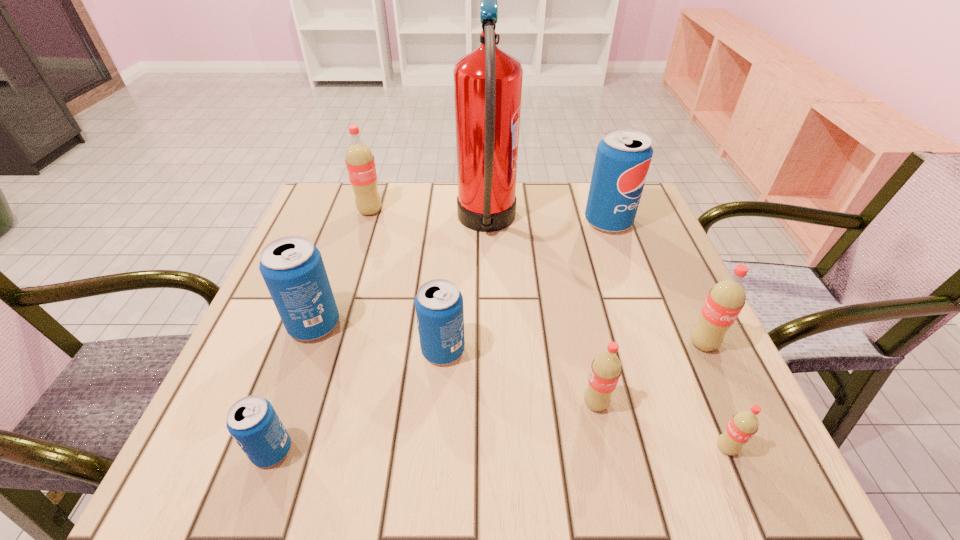
Identify the location of free space at the right edge of the desktop. (651, 294).

Locate an element on the screen. vacant space at the near right corner of the desktop is located at coordinates [x=780, y=478].

Where is `blank region between the fifth soda from right to left and the second smallest red soda`? Image resolution: width=960 pixels, height=540 pixels. blank region between the fifth soda from right to left and the second smallest red soda is located at coordinates (519, 376).

Where is `free space between the second biggest red soda and the third smallest blue soda can`? The width and height of the screenshot is (960, 540). free space between the second biggest red soda and the third smallest blue soda can is located at coordinates (509, 334).

Image resolution: width=960 pixels, height=540 pixels. I want to click on free point between the fourth soda from left to right and the nearest blue soda can, so click(358, 400).

The width and height of the screenshot is (960, 540). Identify the location of vacant area between the rightmost blue soda can and the tallest object. (547, 223).

Where is `free point between the third nearest red soda and the smallest red soda`? free point between the third nearest red soda and the smallest red soda is located at coordinates (714, 396).

Image resolution: width=960 pixels, height=540 pixels. What are the coordinates of `unoccupied position between the leftmost red soda and the third biggest red soda` in the screenshot? It's located at (483, 307).

Find the location of a particular element. This screenshot has width=960, height=540. vacant region between the fifth soda from right to left and the sixth object from left to right is located at coordinates pyautogui.click(x=519, y=376).

Image resolution: width=960 pixels, height=540 pixels. I want to click on free spot between the second biggest blue soda can and the second smallest blue soda can, so click(378, 338).